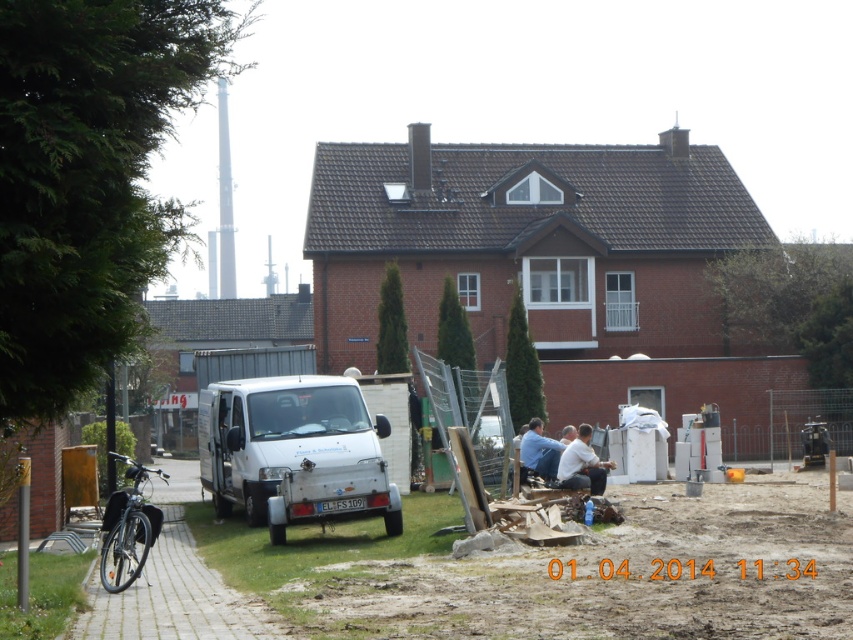
You are a delivery person who needs to park your white matte van at center near the blue fabric shirt at lower center. Is your van large enough to block the view of the shirt from the front of the house?

The white matte van at center is larger in size than blue fabric shirt at lower center, so yes, the van will block the view of the blue fabric shirt at lower center when parked near it.

Consider the image. You are standing at point (583, 438) and want to walk to the brick house in the background. Is the point (210, 474) in your path?

Yes, point (210, 474) is in your path because it is behind point (583, 438), which is your current position. Since you are moving towards the brick house, you will pass through point (210, 474) on your way.

You are a delivery person who needs to park the white matte van at center in a parking spot that can only accommodate vehicles up to the height of the light brown leather jacket at lower center. Can the van be parked there?

The white matte van at center is taller than the light brown leather jacket at lower center, so it cannot be parked in the parking spot that only allows vehicles up to the height of the light brown leather jacket at lower center.